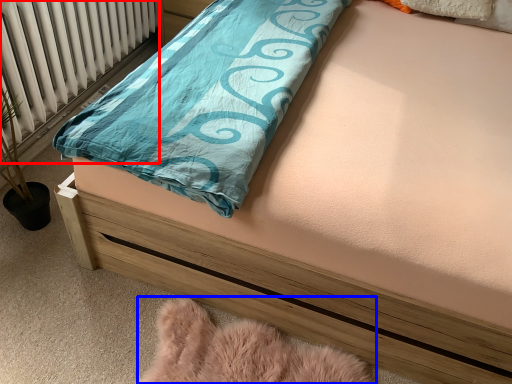
Question: Among these objects, which one is nearest to the camera, radiator (highlighted by a red box) or material (highlighted by a blue box)?

Choices:
 (A) radiator
 (B) material

Answer: (B)